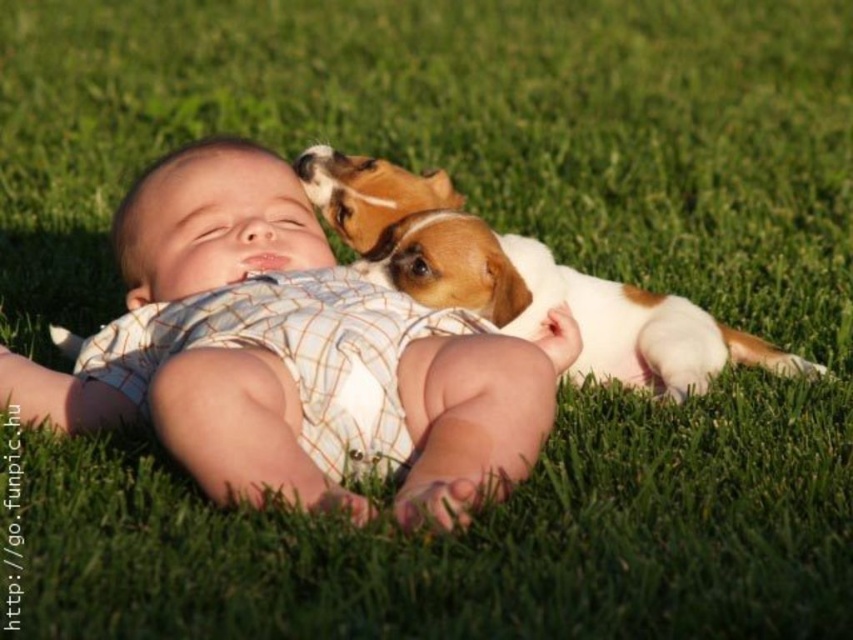
Question: Is matte white baby at center bigger than white fur dog at upper center?

Choices:
 (A) yes
 (B) no

Answer: (A)

Question: Does matte white baby at center have a greater width compared to white fur dog at upper center?

Choices:
 (A) yes
 (B) no

Answer: (B)

Question: In this image, where is matte white baby at center located relative to white fur dog at upper center?

Choices:
 (A) left
 (B) right

Answer: (A)

Question: Among these points, which one is farthest from the camera?

Choices:
 (A) (521, 268)
 (B) (222, 465)

Answer: (A)

Question: Which point appears closest to the camera in this image?

Choices:
 (A) (534, 300)
 (B) (473, 448)

Answer: (B)